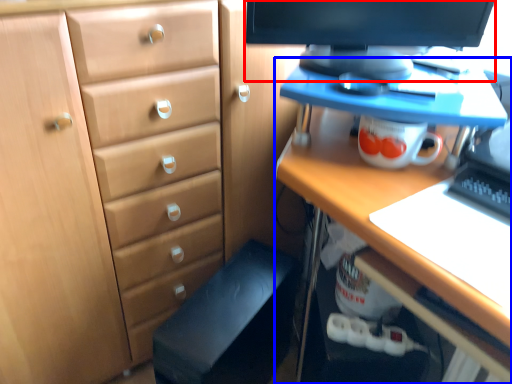
Question: Which object appears closest to the camera in this image, computer monitor (highlighted by a red box) or desk (highlighted by a blue box)?

Choices:
 (A) computer monitor
 (B) desk

Answer: (B)